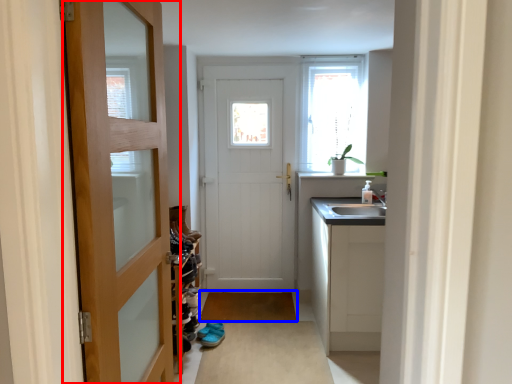
Question: Which object appears closest to the camera in this image, door (highlighted by a red box) or plain (highlighted by a blue box)?

Choices:
 (A) door
 (B) plain

Answer: (A)